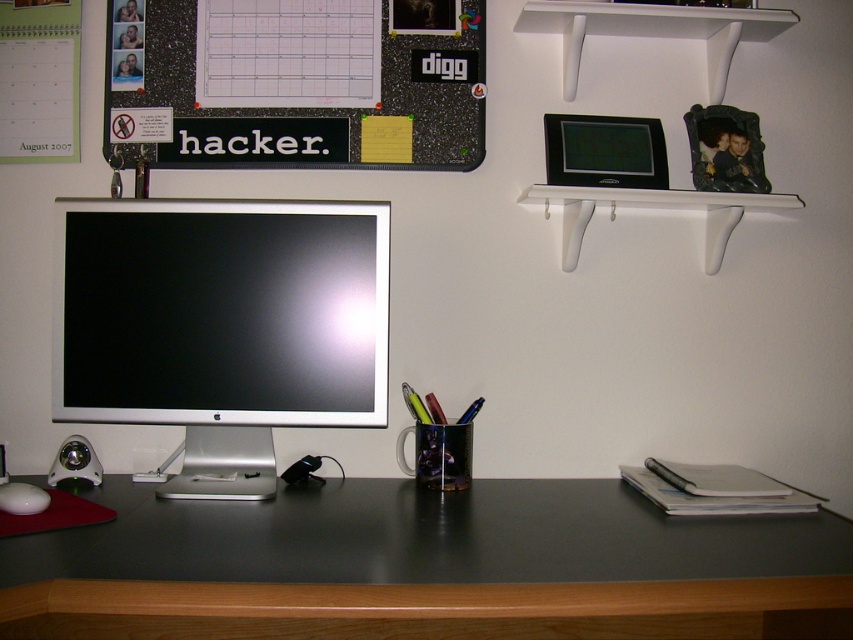
You are sitting at the black matte computer desk at center and want to reach the sleek silver monitor at center. Which direction should you move to get closer to the monitor?

Since the black matte computer desk at center is closer to the viewer than the sleek silver monitor at center, you should move backward to get closer to the sleek silver monitor at center.

You are setting up a new monitor stand for your computer. The stand requires a minimum height of 15 cm to be stable. You have two objects in the scene that could potentially serve as a base. Which object between the white matte shelf at upper right and the white matte mouse at lower left would be more suitable for this purpose?

A: The white matte shelf at upper right is taller than the white matte mouse at lower left, so it would be more suitable as a base for the monitor stand since it meets the minimum height requirement of 15 cm.

You are setting up a new desk organizer and need to choose between placing a decorative item on the white matte shelf at upper right or the white matte mouse at lower left. Based on their sizes, which one can accommodate a larger item?

The white matte shelf at upper right is larger in size than the white matte mouse at lower left, so it can accommodate a larger item.